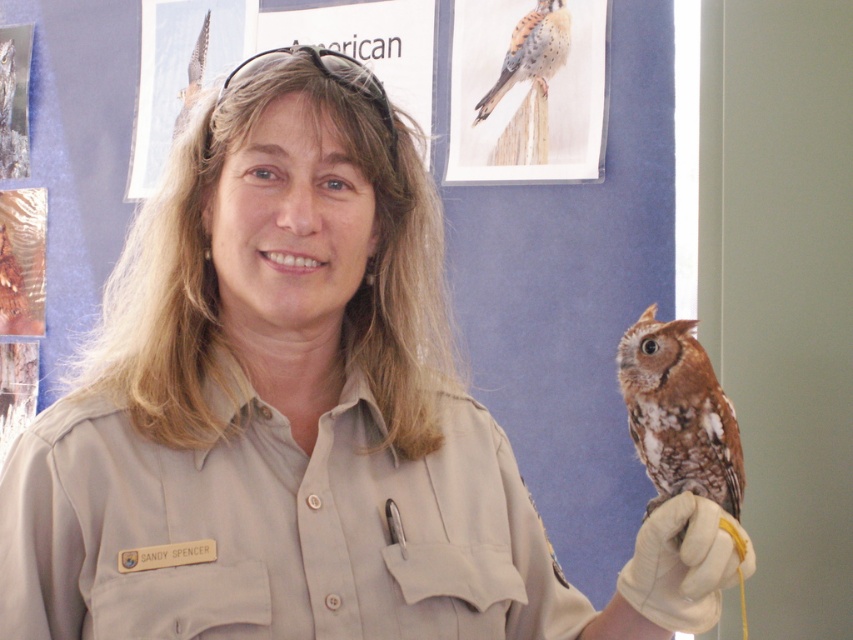
Can you confirm if brown speckled owl at right is positioned to the left of brown speckled feathers at upper center?

No, brown speckled owl at right is not to the left of brown speckled feathers at upper center.

Which of these two, brown speckled owl at right or brown speckled feathers at upper center, stands taller?

brown speckled owl at right

Where is `brown speckled owl at right`? brown speckled owl at right is located at coordinates (677, 413).

Is brown speckled owl at right smaller than white leather glove at lower right?

No.

Between brown speckled owl at right and white leather glove at lower right, which one is positioned higher?

brown speckled owl at right

Is point (653, 356) closer to camera compared to point (751, 566)?

No, it is not.

Locate an element on the screen. brown speckled owl at right is located at coordinates (677, 413).

Who is more forward, (x=657, y=518) or (x=554, y=36)?

Point (x=657, y=518)

Is white leather glove at lower right to the left of brown speckled feathers at upper center from the viewer's perspective?

Incorrect, white leather glove at lower right is not on the left side of brown speckled feathers at upper center.

Locate an element on the screen. white leather glove at lower right is located at coordinates (683, 564).